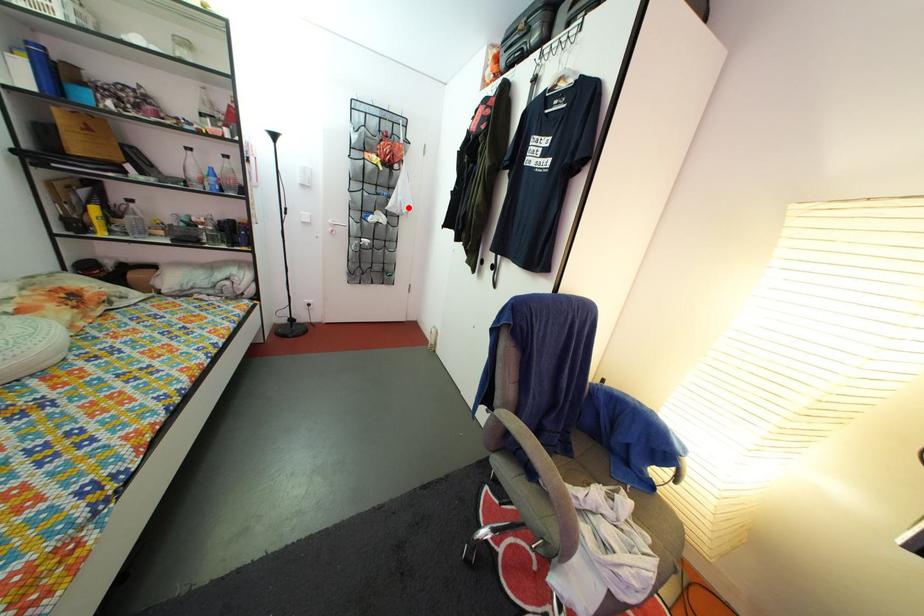
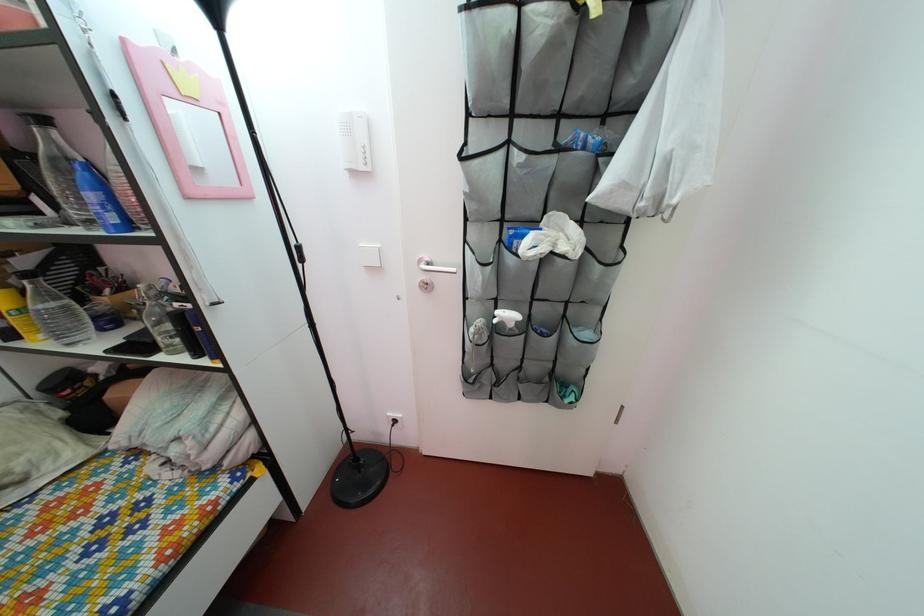
Question: I am providing you with two images of the same scene from different viewpoints. A red point is shown in image1. For the corresponding object point in image2, is it positioned nearer or farther from the camera?

Choices:
 (A) Nearer
 (B) Farther

Answer: (B)